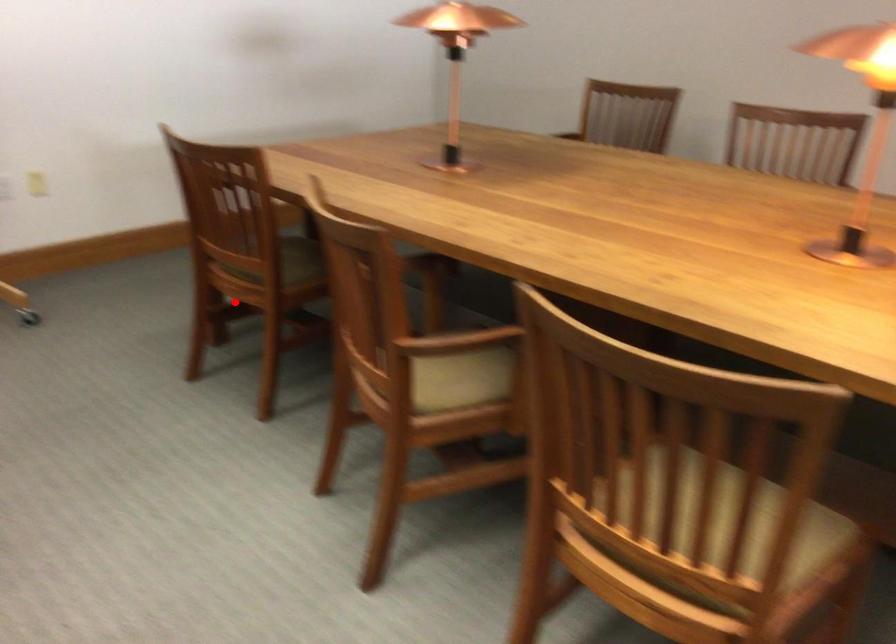
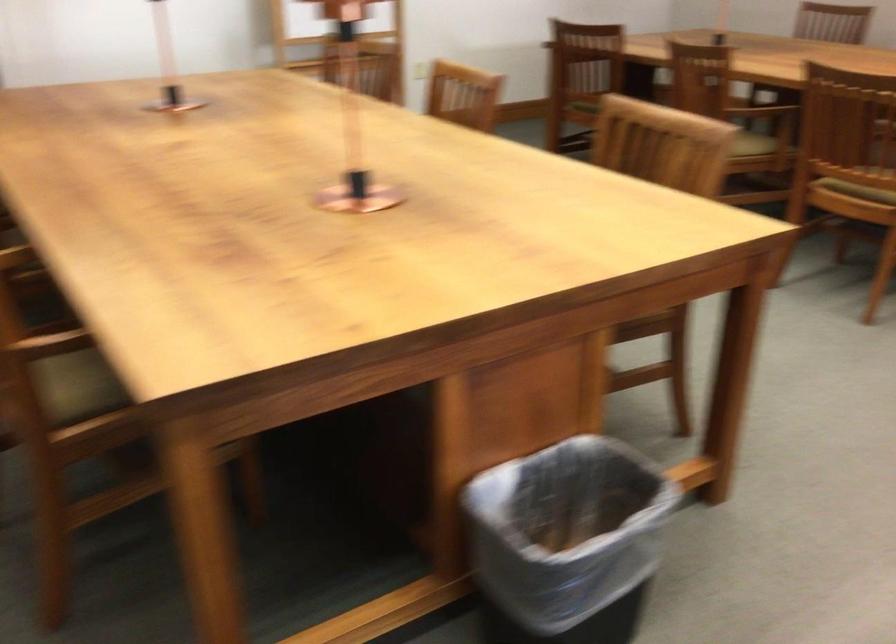
Question: I am providing you with two images of the same scene from different viewpoints. In image1, a red point is highlighted. Considering the same 3D point in image2, which of the following is correct?

Choices:
 (A) It is closer
 (B) It is farther

Answer: (B)